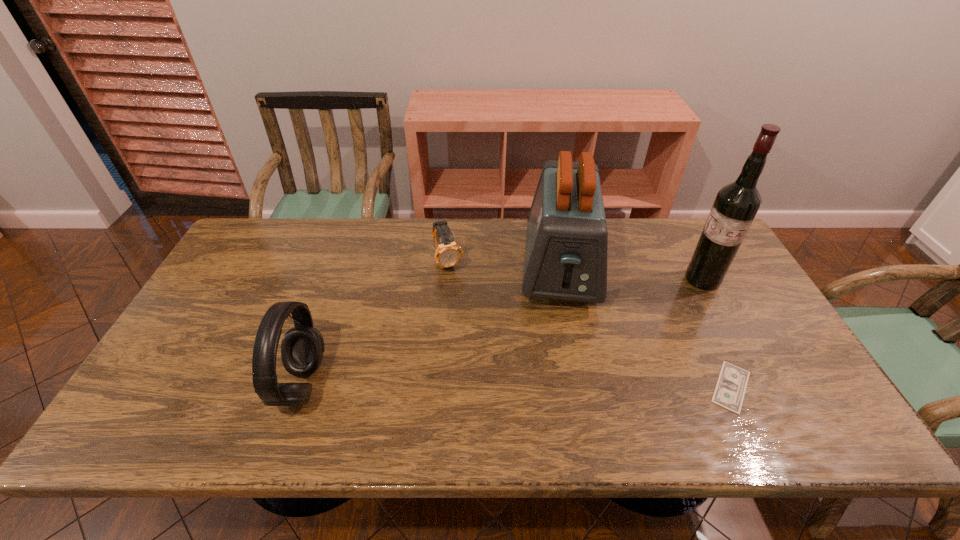
You are a GUI agent. You are given a task and a screenshot of the screen. Output one action in this format:
    pyautogui.click(x=<x>, y=<y>)
    Task: Click on the object that ranks as the closest to the third tallest object
    
    Given the screenshot: What is the action you would take?
    pyautogui.click(x=448, y=253)

You are a GUI agent. You are given a task and a screenshot of the screen. Output one action in this format:
    pyautogui.click(x=<x>, y=<y>)
    Task: Click on the third closest object to the fourth object from right to left
    
    Given the screenshot: What is the action you would take?
    pyautogui.click(x=729, y=392)

Find the location of a particular element. The width and height of the screenshot is (960, 540). vacant region that satisfies the following two spatial constraints: 1. on the front side of the watch; 2. on the left side of the wine bottle is located at coordinates (446, 280).

Image resolution: width=960 pixels, height=540 pixels. In order to click on blank space that satisfies the following two spatial constraints: 1. on the front side of the second shortest object; 2. on the left side of the third object from left to right in this screenshot , I will do pos(447,268).